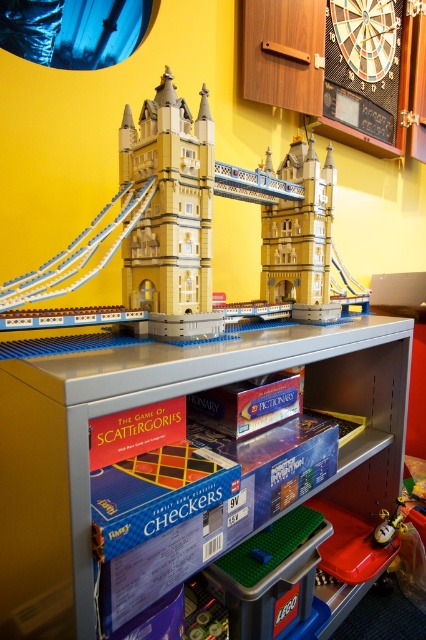
You are standing in front of the shelving unit with the LEGO Tower Bridge model and board games. There are two points marked on the image at coordinates point (180, 381) and point (192, 186). Which of these two points is nearer to you?

Point (180, 381) is closer to the camera than point (192, 186), so the point at (180, 381) is nearer to you.

You are organizing a playroom and need to place a new toy that is 1.2 meters wide. The metallic gray shelf at center is currently holding the yellow matte lego bridge at center. Can the shelf accommodate the new toy without removing the existing items?

The metallic gray shelf at center is bigger than the yellow matte lego bridge at center, so it might have enough space. However, since the exact dimensions of the shelf and the existing items aren not provided, it is uncertain if the 1.2 meter wide toy will fit without removing anything.